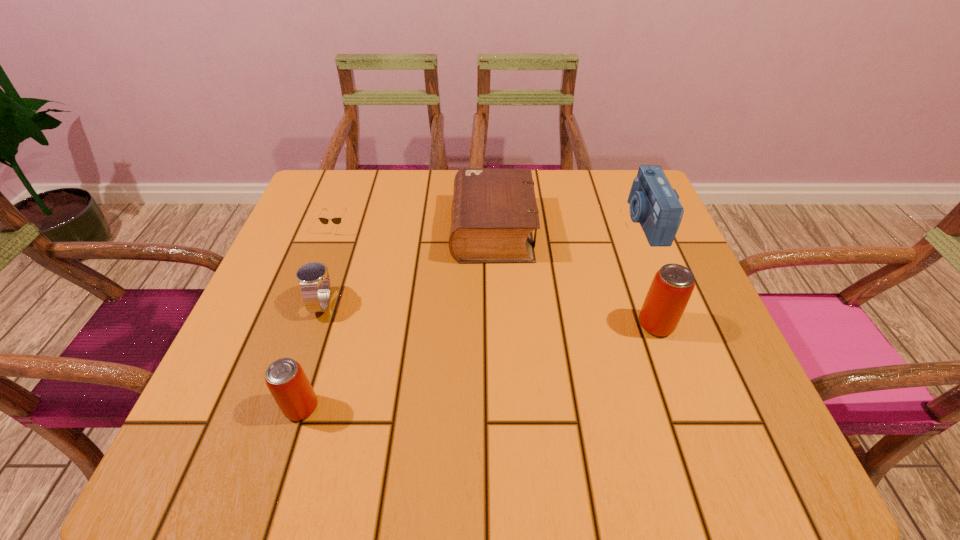
At what (x,y) coordinates should I click in order to perform the action: click on blank region between the sunglasses and the shorter beer can. Please return your answer as a coordinate pair (x, y). Looking at the image, I should click on (320, 319).

Image resolution: width=960 pixels, height=540 pixels. In order to click on vacant space that's between the fourth object from left to right and the shorter beer can in this screenshot , I will do `click(397, 319)`.

The image size is (960, 540). I want to click on vacant area that lies between the shorter beer can and the right beer can, so click(479, 366).

Identify the location of unoccupied area between the taller beer can and the third object from right to left. The height and width of the screenshot is (540, 960). (574, 278).

The image size is (960, 540). What are the coordinates of `free space between the farther beer can and the Bible` in the screenshot? It's located at (574, 278).

Identify which object is the closest to the nearest object. Please provide its 2D coordinates. Your answer should be formatted as a tuple, i.e. [(x, y)], where the tuple contains the x and y coordinates of a point satisfying the conditions above.

[(314, 280)]

You are a GUI agent. You are given a task and a screenshot of the screen. Output one action in this format:
    pyautogui.click(x=<x>, y=<y>)
    Task: Click on the object identified as the closest to the camera
    The width and height of the screenshot is (960, 540).
    Given the screenshot: What is the action you would take?
    pyautogui.click(x=672, y=286)

Identify the location of free location that satisfies the following two spatial constraints: 1. on the lens of the camera; 2. in front of the lenses of the sunglasses. (649, 229).

The height and width of the screenshot is (540, 960). I want to click on vacant area in the image that satisfies the following two spatial constraints: 1. in front of the lenses of the sunglasses; 2. on the left side of the nearer beer can, so click(273, 408).

The height and width of the screenshot is (540, 960). Identify the location of free location that satisfies the following two spatial constraints: 1. in front of the lenses of the sunglasses; 2. on the right side of the tallest object. (302, 325).